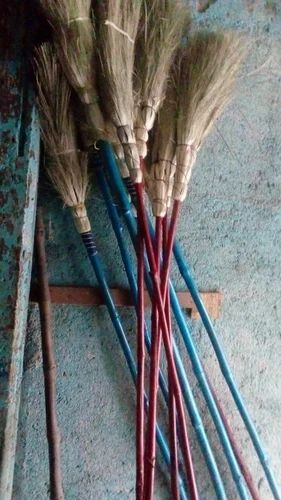
In order to click on broom in this screenshot , I will do `click(139, 155)`.